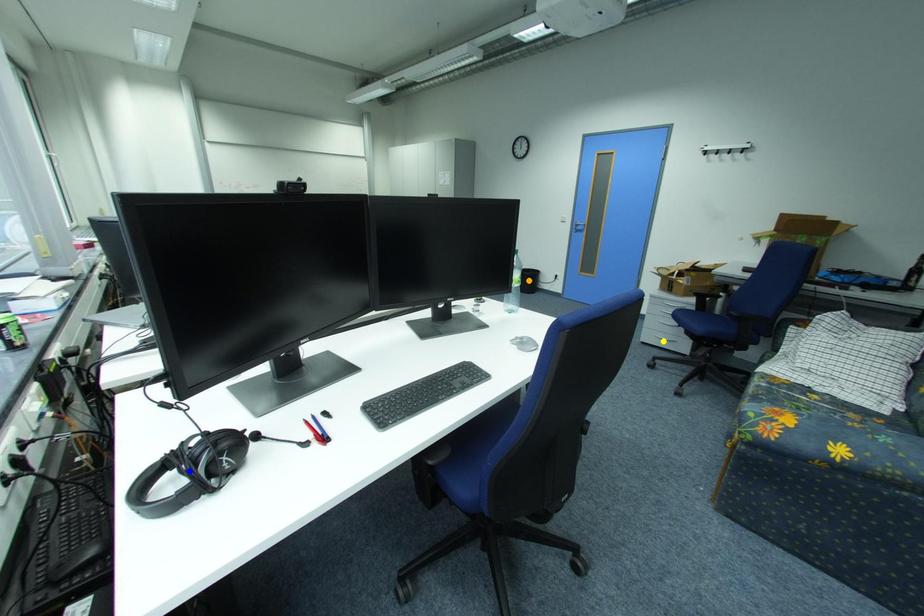
Order these from nearest to farthest:
- orange point
- yellow point
- blue point

blue point < orange point < yellow point